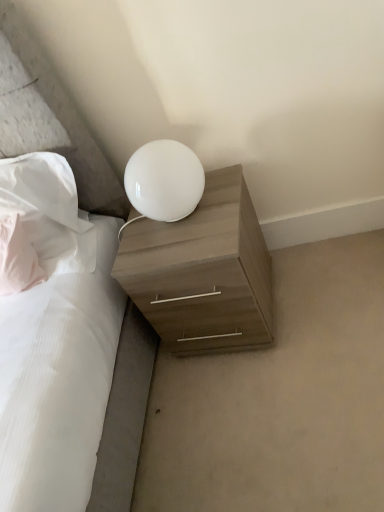
Find the location of a particular element. This screenshot has width=384, height=512. vacant area that is situated to the right of light wood/texture nightstand at lower right is located at coordinates (316, 286).